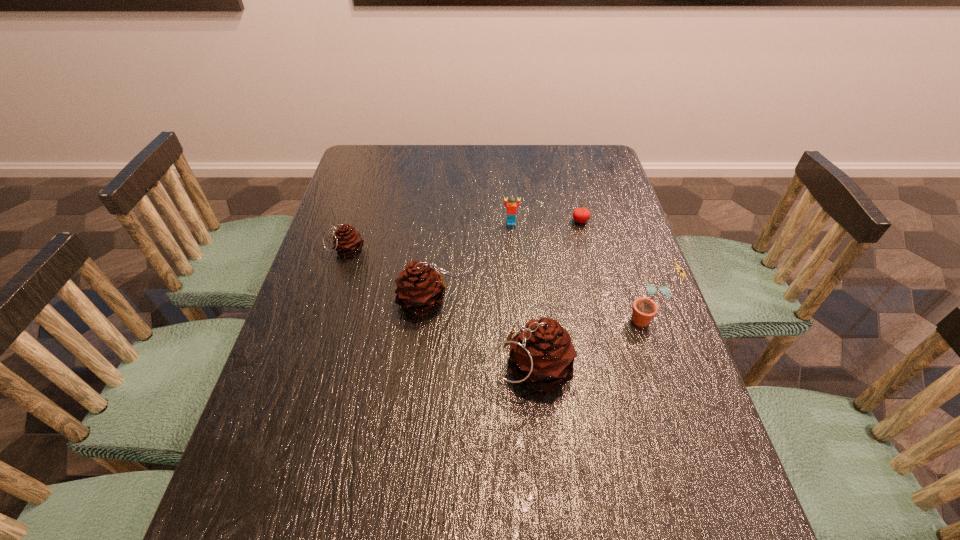
Where is `the leftmost pinecone`? The width and height of the screenshot is (960, 540). the leftmost pinecone is located at coordinates (347, 241).

This screenshot has width=960, height=540. What are the coordinates of `the shortest pinecone` in the screenshot? It's located at (347, 241).

Identify the location of the second pinecone from left to right. (419, 291).

The height and width of the screenshot is (540, 960). What are the coordinates of `the second object from left to right` in the screenshot? It's located at (419, 291).

Where is `the nearest object`? Image resolution: width=960 pixels, height=540 pixels. the nearest object is located at coordinates (541, 356).

Locate an element on the screen. This screenshot has height=540, width=960. the rightmost pinecone is located at coordinates (541, 356).

What are the coordinates of `the second object from right to left` in the screenshot? It's located at (581, 215).

Locate an element on the screen. The height and width of the screenshot is (540, 960). Lego is located at coordinates (511, 207).

The image size is (960, 540). Identify the location of sunflower. (644, 309).

I want to click on vacant area located with a leaf charm attached to the second nearest pinecone, so click(x=607, y=302).